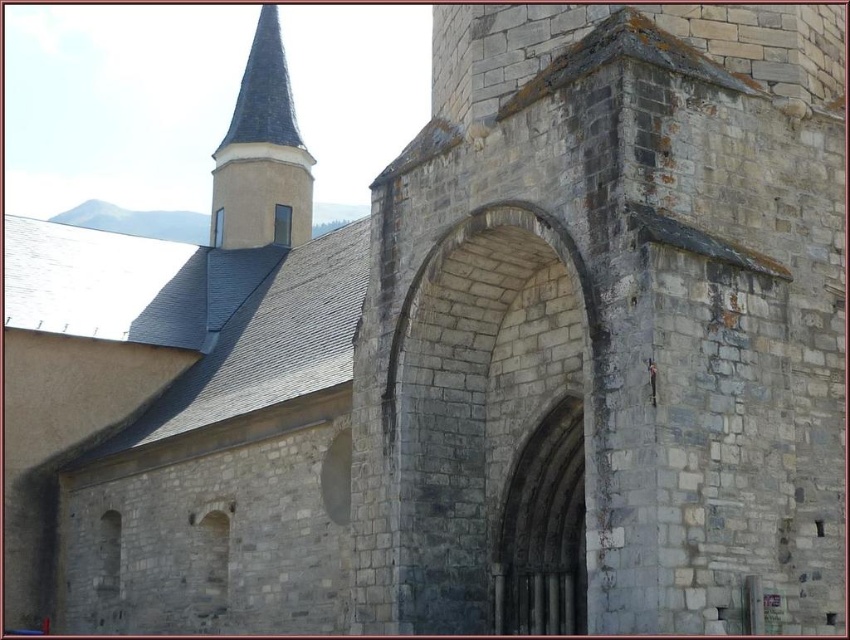
Is point (536, 461) positioned after point (265, 36)?

No, (536, 461) is closer to viewer.

Identify the location of gray stone archway at center. The image size is (850, 640). (490, 432).